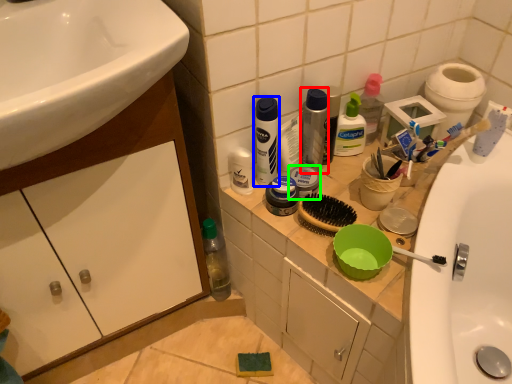
Question: Which object is positioned farthest from toiletry (highlighted by a red box)? Select from mouthwash (highlighted by a blue box) and toiletry (highlighted by a green box).

Choices:
 (A) mouthwash
 (B) toiletry

Answer: (A)